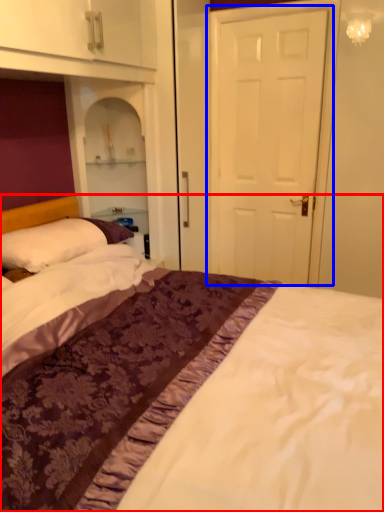
Question: Which object is further to the camera taking this photo, bed (highlighted by a red box) or door (highlighted by a blue box)?

Choices:
 (A) bed
 (B) door

Answer: (B)